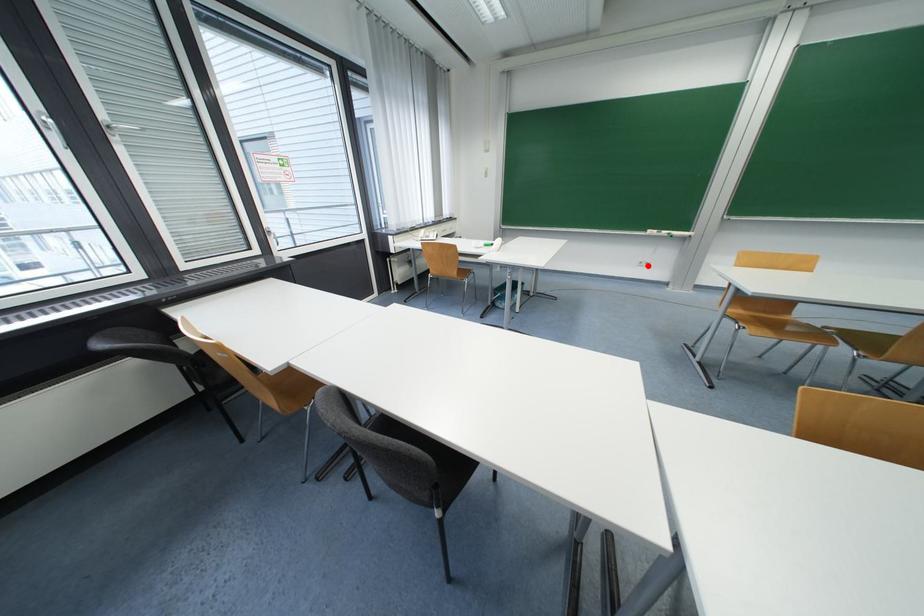
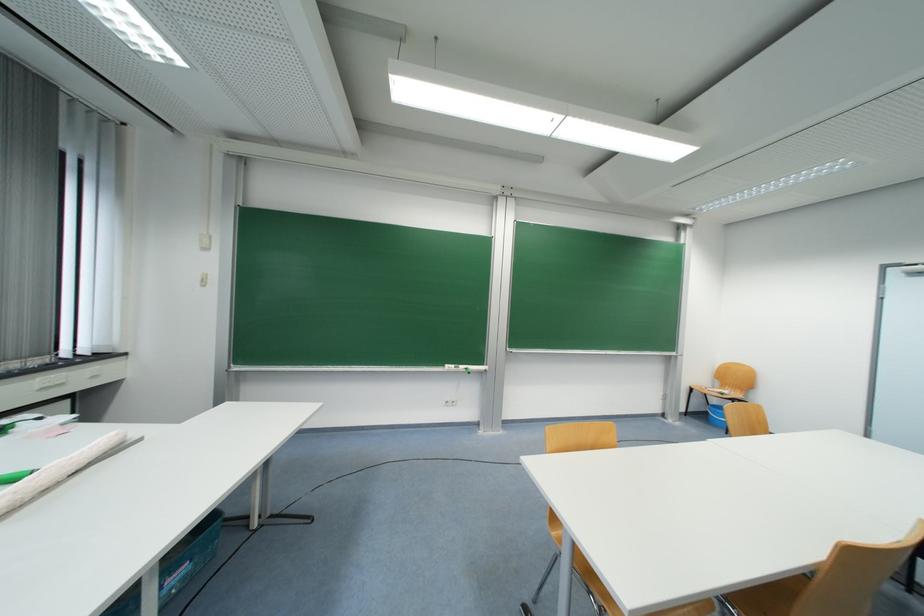
Question: I am providing you with two images of the same scene from different viewpoints. Image1 has a red point marked. In image2, the corresponding 3D location appears at what relative position? Reply with the corresponding letter.

Choices:
 (A) Closer
 (B) Farther

Answer: (B)